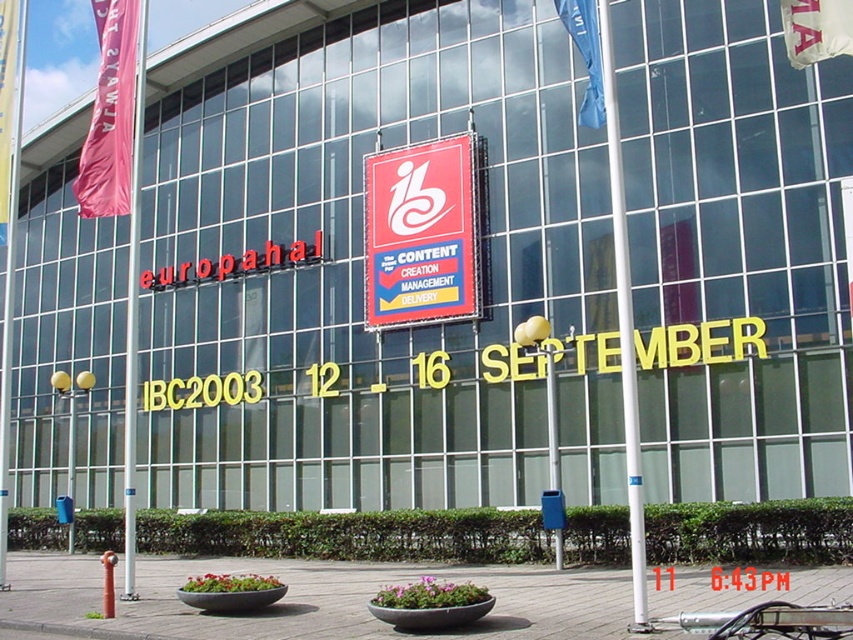
Is red plastic sign at center thinner than pink fabric banner at upper left?

Indeed, red plastic sign at center has a lesser width compared to pink fabric banner at upper left.

Which is below, red plastic sign at center or pink fabric banner at upper left?

red plastic sign at center is lower down.

Between point (422, 301) and point (131, 164), which one is positioned behind?

The point (422, 301) is more distant.

This screenshot has width=853, height=640. In order to click on red plastic sign at center in this screenshot , I will do `click(421, 234)`.

Does point (1, 216) come farther from viewer compared to point (584, 3)?

Yes, it is behind point (584, 3).

Is pink fabric flag at left above blue fabric flag at upper right?

No.

Identify the location of pink fabric flag at left. The width and height of the screenshot is (853, 640). (7, 106).

Between point (428, 256) and point (12, 106), which one is positioned in front?

Point (12, 106) is in front.

Who is higher up, red plastic sign at center or pink fabric flag at left?

pink fabric flag at left is above.

Does point (469, 198) come in front of point (4, 100)?

No, (469, 198) is further to viewer.

This screenshot has height=640, width=853. Identify the location of red plastic sign at center. (421, 234).